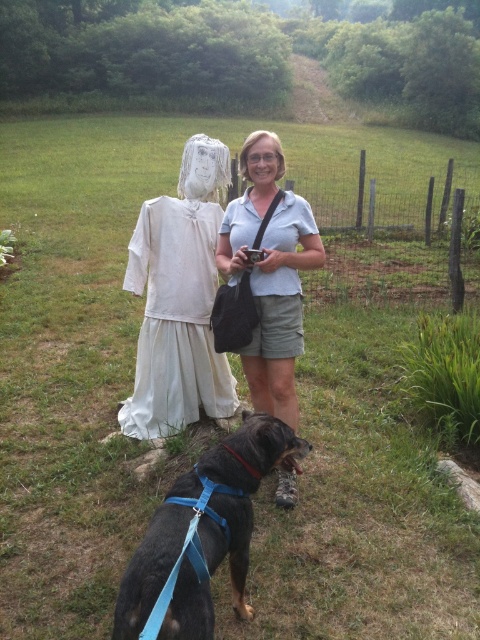
Based on the photo, you are a fashion designer who needs to determine which garment is larger between the white cotton dress at left and the light blue cotton shirt at center. Based on the scene description, which one is bigger?

The white cotton dress at left is bigger than the light blue cotton shirt at center according to the description.

You are organizing a clothing display in a small store. The display area has a width of 1.2 meters. You have two items to place side by side without overlapping. The items are the white cotton dress at left and the light blue cotton shirt at center. Which item should you place first to ensure both fit within the display area?

The white cotton dress at left is wider than the light blue cotton shirt at center. To fit both items side by side within the 1.2 meter display area, place the wider white cotton dress at left first, then the narrower light blue cotton shirt at center. The total width would be the sum of both items, but since the white cotton dress at left is larger, arranging them in this order ensures they can fit if their combined width is under 1.2 meters.